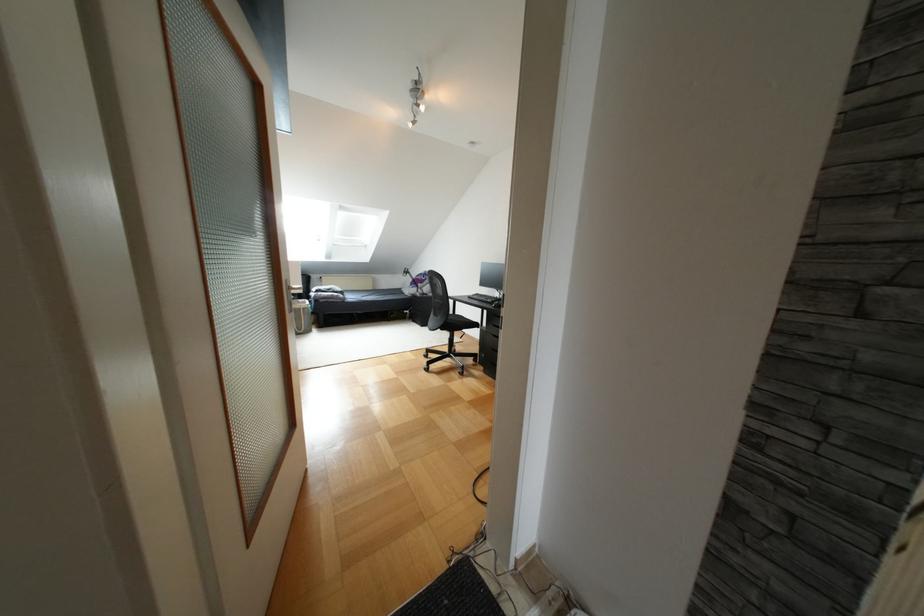
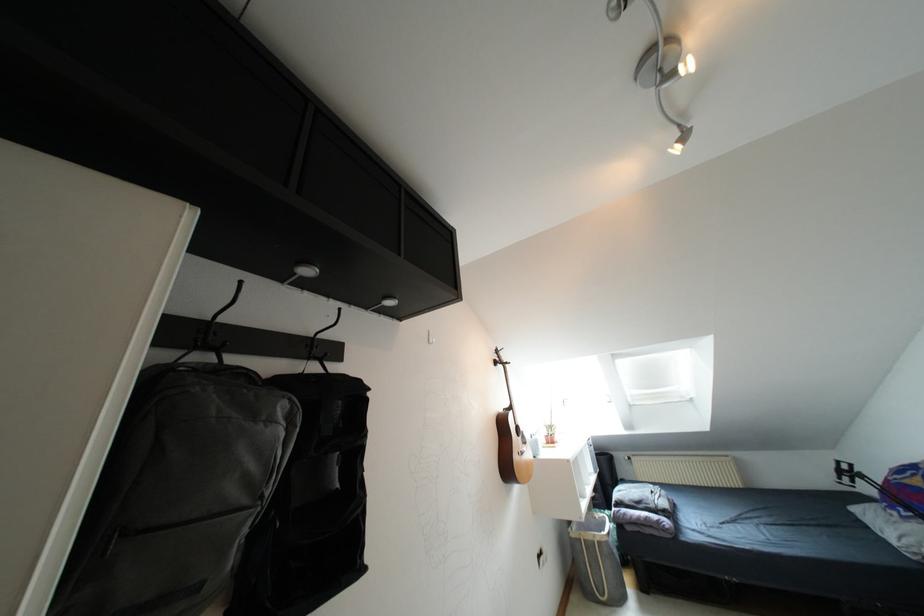
In the second image, find the point that corresponds to (x=412, y=122) in the first image.

(683, 138)